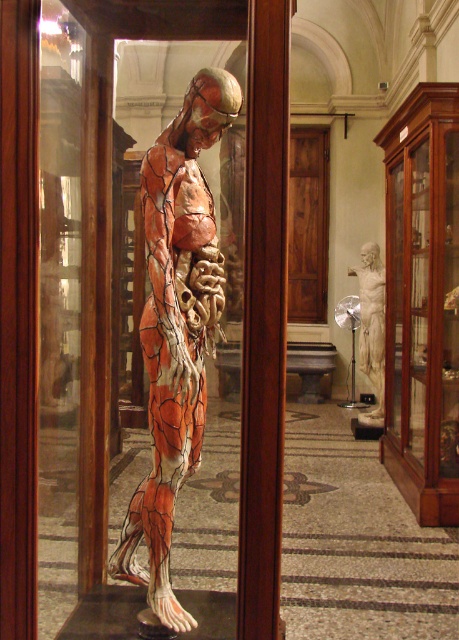
Who is more forward, [189,228] or [369,264]?

Point [189,228]

Is orange painted anatomical model at center positioned at the back of white marble statue at center?

That is False.

What are the coordinates of `orange painted anatomical model at center` in the screenshot? It's located at (177, 326).

I want to click on orange painted anatomical model at center, so click(x=177, y=326).

Between transparent glass at center and white marble statue at center, which one is positioned lower?

white marble statue at center is below.

Is point (246, 474) farther from camera compared to point (367, 416)?

No, it is in front of (367, 416).

Is point (129, 6) positioned in front of point (378, 332)?

That is True.

Locate an element on the screen. The width and height of the screenshot is (459, 640). transparent glass at center is located at coordinates click(x=261, y=340).

Who is positioned more to the right, transparent glass at center or orange painted anatomical model at center?

orange painted anatomical model at center

Is transparent glass at center behind orange painted anatomical model at center?

Yes, transparent glass at center is behind orange painted anatomical model at center.

Does point (279, 344) come in front of point (179, 474)?

Yes, point (279, 344) is closer to viewer.

Identify the location of transparent glass at center. This screenshot has height=640, width=459. (261, 340).